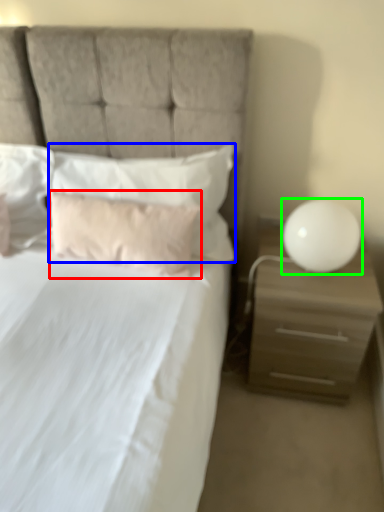
Question: Estimate the real-world distances between objects in this image. Which object is closer to pillow (highlighted by a red box), pillow (highlighted by a blue box) or table lamp (highlighted by a green box)?

Choices:
 (A) pillow
 (B) table lamp

Answer: (A)